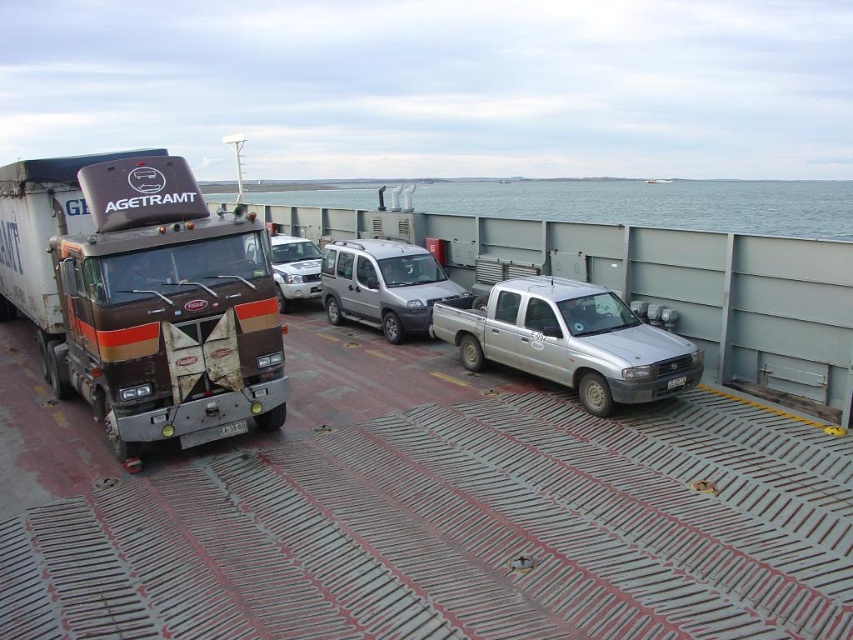
Does point (587, 310) come behind point (293, 257)?

No, (587, 310) is closer to viewer.

Does silver metallic pickup truck at center lie behind white matte suv at center?

No, it is not.

This screenshot has height=640, width=853. What are the coordinates of `silver metallic pickup truck at center` in the screenshot? It's located at (567, 340).

Does silver metallic pickup truck at center appear on the left side of white plastic license plate at center?

Incorrect, silver metallic pickup truck at center is not on the left side of white plastic license plate at center.

Can you confirm if silver metallic pickup truck at center is positioned to the right of white plastic license plate at center?

Correct, you'll find silver metallic pickup truck at center to the right of white plastic license plate at center.

Which is behind, point (630, 387) or point (225, 433)?

The point (630, 387) is behind.

Find the location of a particular element. The height and width of the screenshot is (640, 853). silver metallic pickup truck at center is located at coordinates (567, 340).

Does point (305, 198) lie in front of point (647, 388)?

No, (305, 198) is further to viewer.

Does gray water at upper center have a lesser width compared to silver metallic pickup truck at center?

No.

Is point (683, 221) positioned after point (500, 346)?

Yes, it is behind point (500, 346).

The height and width of the screenshot is (640, 853). Find the location of `gray water at upper center`. gray water at upper center is located at coordinates (657, 204).